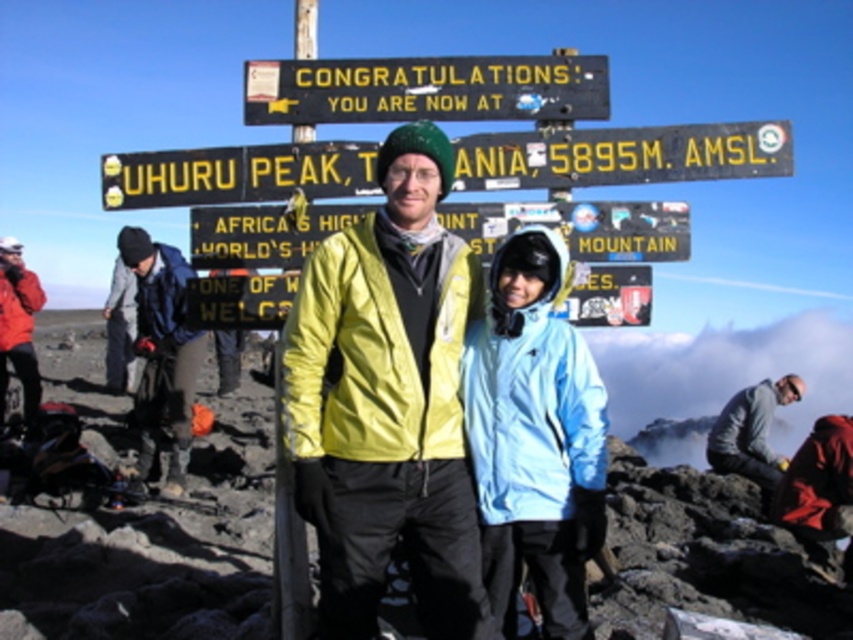
Does light blue fabric jacket at center come behind brushed metal jacket at lower left?

No, light blue fabric jacket at center is closer to the viewer.

Can you confirm if light blue fabric jacket at center is shorter than brushed metal jacket at lower left?

Yes.

Does point (515, 260) lie in front of point (200, 333)?

Yes, point (515, 260) is closer to viewer.

I want to click on light blue fabric jacket at center, so click(534, 436).

Is point (300, 115) closer to viewer compared to point (138, 244)?

Yes, point (300, 115) is in front of point (138, 244).

You are a GUI agent. You are given a task and a screenshot of the screen. Output one action in this format:
    pyautogui.click(x=<x>, y=<y>)
    Task: Click on the yellow painted wood sign at upper center
    
    Given the screenshot: What is the action you would take?
    pyautogui.click(x=426, y=90)

Who is taller, light blue fabric jacket at center or yellow painted wood sign at upper center?

light blue fabric jacket at center

Can you confirm if light blue fabric jacket at center is thinner than yellow painted wood sign at upper center?

Yes.

Which is behind, point (485, 388) or point (247, 99)?

The point (247, 99) is more distant.

Where is `light blue fabric jacket at center`? light blue fabric jacket at center is located at coordinates click(534, 436).